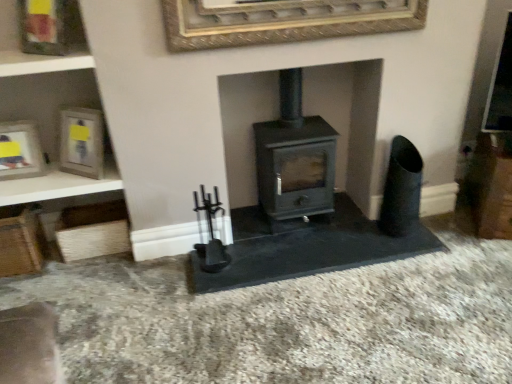
Question: From the image's perspective, is gold textured picture frame at upper center, acting as the first picture frame starting from the right, on matte silver picture frame at left, arranged as the 1th picture frame when viewed from the left?

Choices:
 (A) yes
 (B) no

Answer: (A)

Question: Is gold textured picture frame at upper center, the fourth picture frame from the left, far away from matte silver picture frame at left, placed as the fourth picture frame when sorted from right to left?

Choices:
 (A) yes
 (B) no

Answer: (A)

Question: Is gold textured picture frame at upper center, acting as the first picture frame starting from the right, to the left of matte silver picture frame at left, arranged as the 1th picture frame when viewed from the left, from the viewer's perspective?

Choices:
 (A) no
 (B) yes

Answer: (A)

Question: Is matte silver picture frame at left, placed as the fourth picture frame when sorted from right to left, located within gold textured picture frame at upper center, acting as the first picture frame starting from the right?

Choices:
 (A) no
 (B) yes

Answer: (A)

Question: Is gold textured picture frame at upper center, the fourth picture frame from the left, turned away from matte silver picture frame at left, placed as the fourth picture frame when sorted from right to left?

Choices:
 (A) yes
 (B) no

Answer: (B)

Question: Is gold textured picture frame at upper center, the fourth picture frame from the left, not inside matte silver picture frame at left, arranged as the 1th picture frame when viewed from the left?

Choices:
 (A) yes
 (B) no

Answer: (A)

Question: Is wooden frame at upper left, the 2th picture frame from the left, at the left side of wooden shelf at upper left?

Choices:
 (A) yes
 (B) no

Answer: (B)

Question: Does wooden frame at upper left, the 2th picture frame from the left, lie in front of wooden shelf at upper left?

Choices:
 (A) no
 (B) yes

Answer: (B)

Question: Is wooden frame at upper left, the third picture frame when ordered from right to left, facing away from wooden shelf at upper left?

Choices:
 (A) no
 (B) yes

Answer: (A)

Question: Considering the relative sizes of wooden frame at upper left, the 2th picture frame from the left, and wooden shelf at upper left in the image provided, is wooden frame at upper left, the 2th picture frame from the left, taller than wooden shelf at upper left?

Choices:
 (A) yes
 (B) no

Answer: (A)

Question: Is wooden frame at upper left, the third picture frame when ordered from right to left, at the right side of wooden shelf at upper left?

Choices:
 (A) yes
 (B) no

Answer: (A)

Question: From the image's perspective, does wooden frame at upper left, the 2th picture frame from the left, appear higher than wooden shelf at upper left?

Choices:
 (A) yes
 (B) no

Answer: (A)

Question: Is gold textured picture frame at upper center, the fourth picture frame from the left, at the right side of wooden frame at upper left, the third picture frame when ordered from right to left?

Choices:
 (A) yes
 (B) no

Answer: (A)